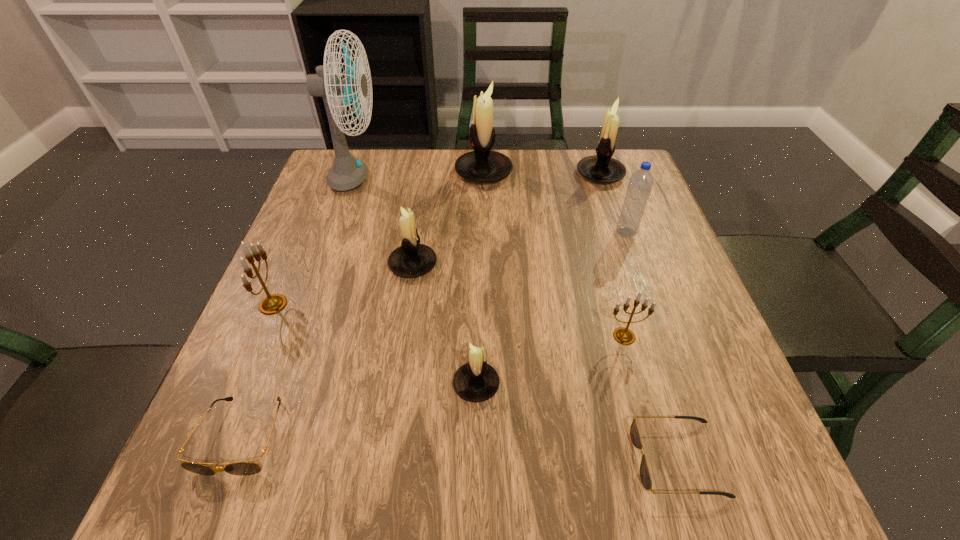
In the image, there is a desktop. At what (x,y) coordinates should I click in order to perform the action: click on vacant area at the near edge. Please return your answer as a coordinate pair (x, y). The image size is (960, 540). Looking at the image, I should click on (533, 497).

The image size is (960, 540). I want to click on blank area at the left edge, so click(328, 284).

This screenshot has width=960, height=540. I want to click on free space at the right edge of the desktop, so click(675, 295).

Where is `free space at the far left corner of the desktop`? The height and width of the screenshot is (540, 960). free space at the far left corner of the desktop is located at coordinates (330, 195).

At what (x,y) coordinates should I click in order to perform the action: click on vacant space at the far right corner of the desktop. Please return your answer as a coordinate pair (x, y). The height and width of the screenshot is (540, 960). Looking at the image, I should click on (650, 198).

Locate an element on the screen. free spot at the near right corner of the desktop is located at coordinates (670, 446).

This screenshot has width=960, height=540. Find the location of `unoccupied position between the right black sunglasses and the ninth shortest object`. unoccupied position between the right black sunglasses and the ninth shortest object is located at coordinates (581, 315).

Locate an element on the screen. This screenshot has width=960, height=540. vacant area that lies between the water bottle and the fourth nearest candle holder is located at coordinates (519, 248).

The width and height of the screenshot is (960, 540). What are the coordinates of `unoccupied position between the nearest candle holder and the right black sunglasses` in the screenshot? It's located at (x=577, y=421).

At what (x,y) coordinates should I click in order to perform the action: click on empty location between the gray fan and the smaller gold candelabrum. Please return your answer as a coordinate pair (x, y). Looking at the image, I should click on (490, 258).